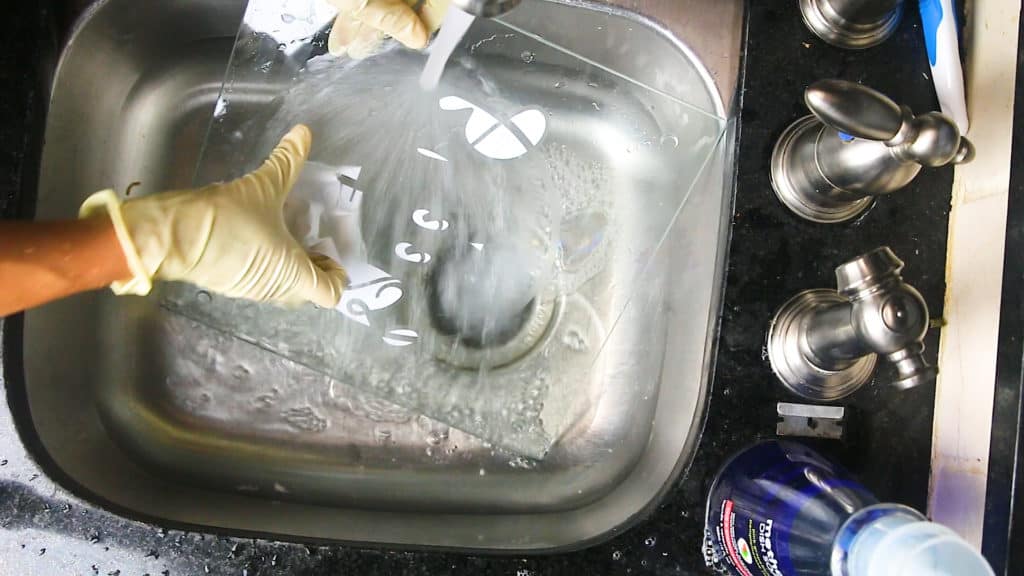
Where is `suds beneath dish soap bottle`? This screenshot has height=576, width=1024. suds beneath dish soap bottle is located at coordinates (707, 549).